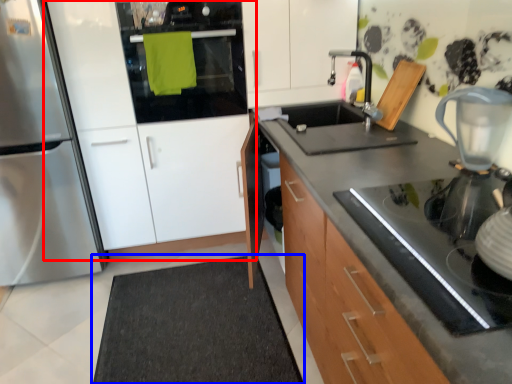
Question: Which point is closer to the camera, cabinetry (highlighted by a red box) or doormat (highlighted by a blue box)?

Choices:
 (A) cabinetry
 (B) doormat

Answer: (B)